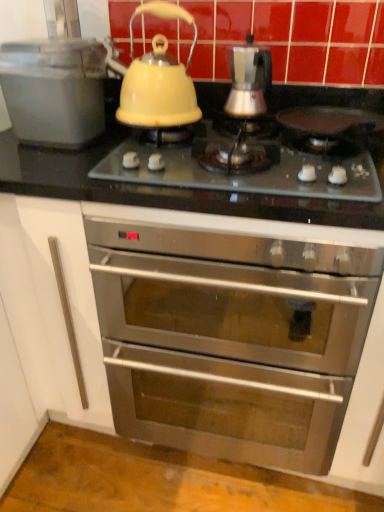
Question: Is satin silver coffee maker at center, which ranks as the 1th kitchen appliance in right-to-left order, in front of or behind matte plastic container at left, placed as the 2th kitchen appliance when sorted from right to left, in the image?

Choices:
 (A) behind
 (B) front

Answer: (A)

Question: Looking at their shapes, would you say satin silver coffee maker at center, which ranks as the 1th kitchen appliance in right-to-left order, is wider or thinner than matte plastic container at left, placed as the 1th kitchen appliance when sorted from left to right?

Choices:
 (A) thin
 (B) wide

Answer: (A)

Question: Considering the real-world distances, which object is closest to the matte plastic container at left, placed as the 1th kitchen appliance when sorted from left to right?

Choices:
 (A) matte glass cooktop at center
 (B) yellow glossy kettle at upper center
 (C) stainless steel oven at center
 (D) satin silver coffee maker at center, positioned as the 2th kitchen appliance in left-to-right order

Answer: (B)

Question: Considering the real-world distances, which object is closest to the matte glass cooktop at center?

Choices:
 (A) satin silver coffee maker at center, which ranks as the 1th kitchen appliance in right-to-left order
 (B) matte plastic container at left, placed as the 2th kitchen appliance when sorted from right to left
 (C) yellow glossy kettle at upper center
 (D) stainless steel oven at center

Answer: (C)